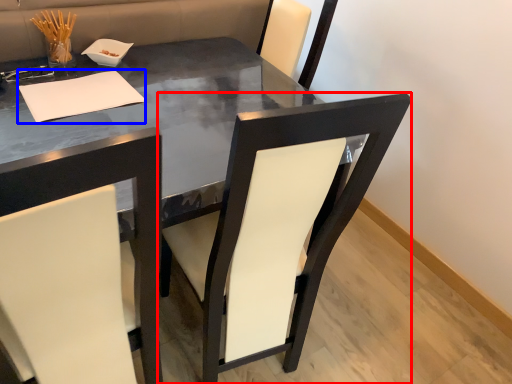
Question: Which object is further to the camera taking this photo, chair (highlighted by a red box) or notepad (highlighted by a blue box)?

Choices:
 (A) chair
 (B) notepad

Answer: (B)